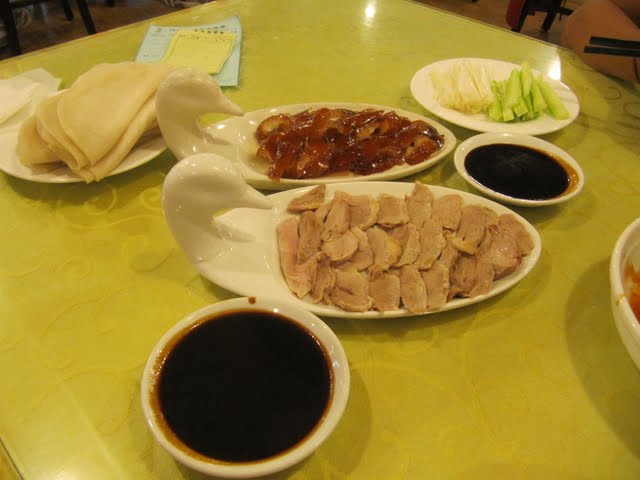
What are the coordinates of `light beige rim of bowl` in the screenshot? It's located at (340, 369), (166, 448).